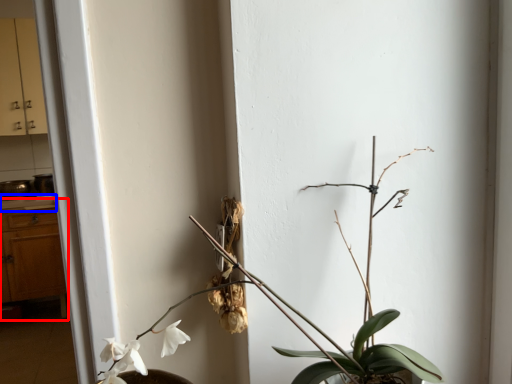
Question: Among these objects, which one is nearest to the camera, dresser (highlighted by a red box) or counter top (highlighted by a blue box)?

Choices:
 (A) dresser
 (B) counter top

Answer: (A)